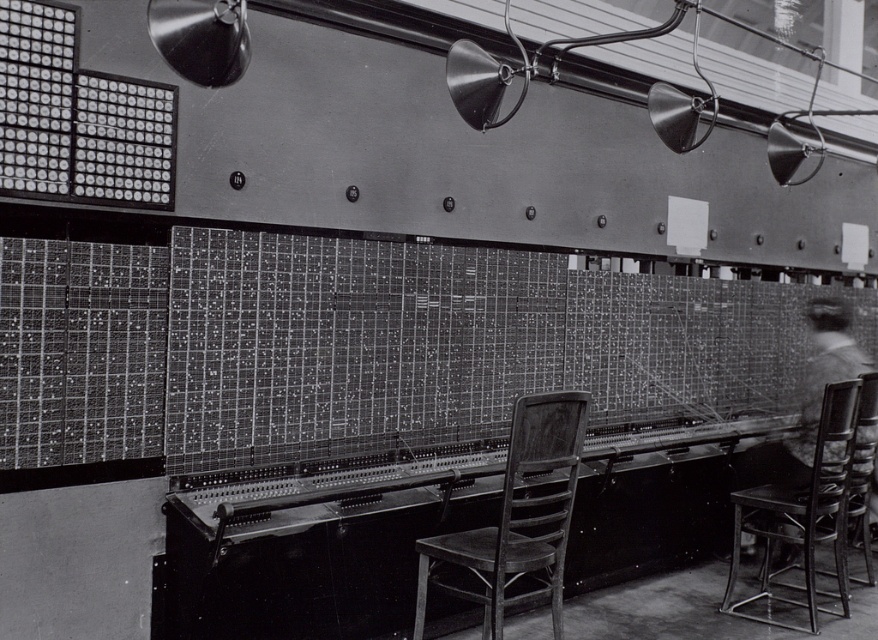
Question: Which object appears farthest from the camera in this image?

Choices:
 (A) wooden chair at center
 (B) wooden chair at right

Answer: (B)

Question: Which point is farther to the camera?

Choices:
 (A) (509, 557)
 (B) (841, 508)

Answer: (B)

Question: Is wooden chair at center above wooden chair at right?

Choices:
 (A) yes
 (B) no

Answer: (A)

Question: Can you confirm if wooden chair at center is positioned above wooden chair at right?

Choices:
 (A) no
 (B) yes

Answer: (B)

Question: Which point is farther from the camera taking this photo?

Choices:
 (A) (555, 413)
 (B) (764, 499)

Answer: (B)

Question: Does wooden chair at center lie in front of wooden chair at right?

Choices:
 (A) yes
 (B) no

Answer: (A)